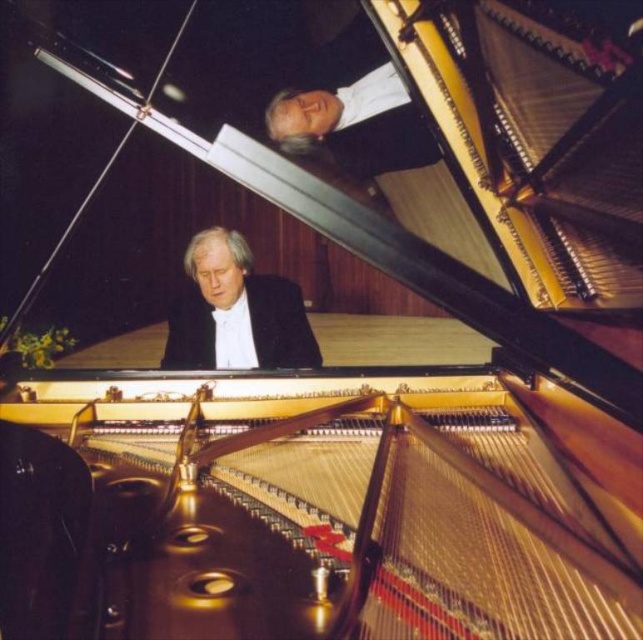
Question: Is matte black suit at center wider than white silk shirt at upper center?

Choices:
 (A) yes
 (B) no

Answer: (A)

Question: Which point is farther to the camera?

Choices:
 (A) matte black suit at center
 (B) white silk shirt at upper center

Answer: (B)

Question: Is the position of matte black suit at center less distant than that of white silk shirt at upper center?

Choices:
 (A) no
 (B) yes

Answer: (B)

Question: Is matte black suit at center positioned in front of white silk shirt at upper center?

Choices:
 (A) yes
 (B) no

Answer: (A)